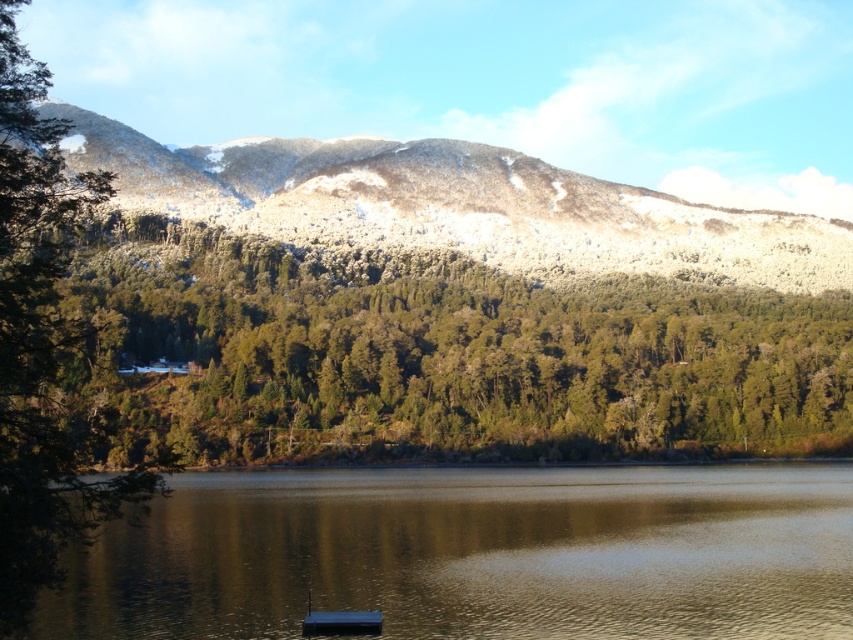
Which is more to the left, green textured trees at center or smooth reflective water at center?

smooth reflective water at center

Can you confirm if green textured trees at center is positioned above smooth reflective water at center?

Yes.

Between point (132, 353) and point (593, 577), which one is positioned behind?

Point (132, 353)

This screenshot has height=640, width=853. I want to click on green textured trees at center, so click(427, 356).

Who is higher up, snowy forested mountain at upper center or metallic blue boat at lower center?

snowy forested mountain at upper center is above.

Between snowy forested mountain at upper center and metallic blue boat at lower center, which one is positioned lower?

metallic blue boat at lower center

The width and height of the screenshot is (853, 640). What do you see at coordinates (457, 205) in the screenshot?
I see `snowy forested mountain at upper center` at bounding box center [457, 205].

Image resolution: width=853 pixels, height=640 pixels. I want to click on snowy forested mountain at upper center, so click(x=457, y=205).

Is green textured trees at center to the left of snowy forested mountain at upper center from the viewer's perspective?

Incorrect, green textured trees at center is not on the left side of snowy forested mountain at upper center.

Which is above, green textured trees at center or snowy forested mountain at upper center?

snowy forested mountain at upper center is above.

The width and height of the screenshot is (853, 640). I want to click on green textured trees at center, so click(x=427, y=356).

Find the location of a particular element. green textured trees at center is located at coordinates (427, 356).